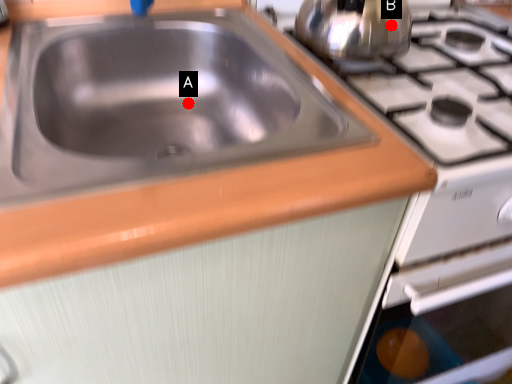
Question: Two points are circled on the image, labeled by A and B beside each circle. Which point is farther from the camera taking this photo?

Choices:
 (A) A is further
 (B) B is further

Answer: (A)